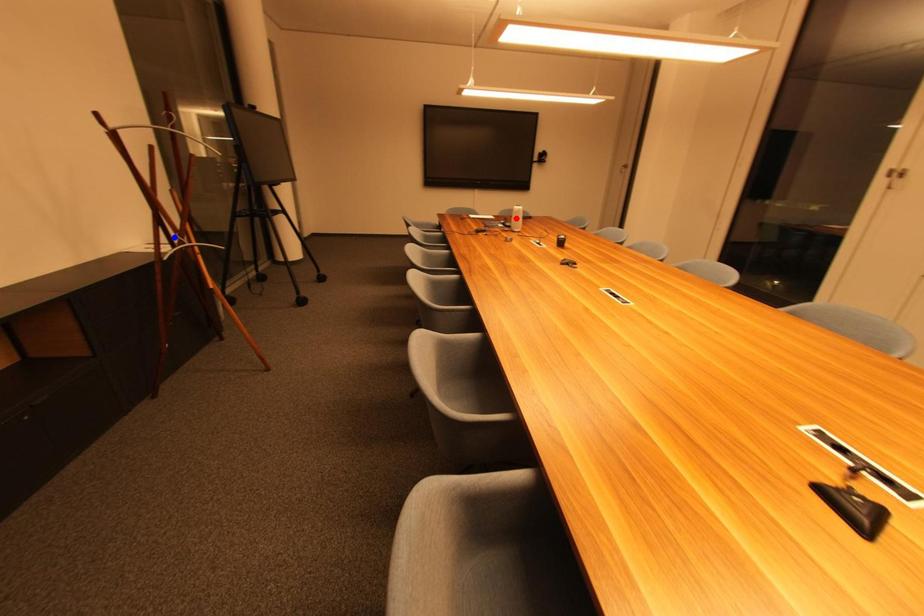
Question: Which of the two points in the image is closer to the camera?

Choices:
 (A) Blue point is closer.
 (B) Red point is closer.

Answer: (A)